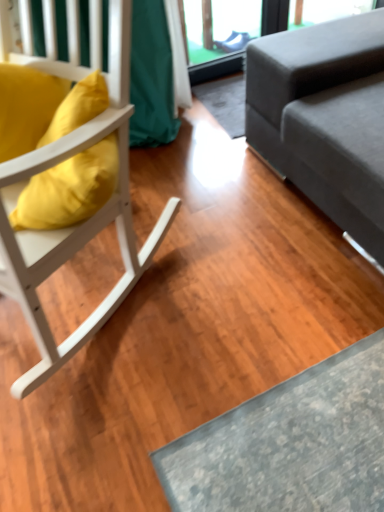
Question: From the image's perspective, is matte yellow pillow at left located above or below gray fabric couch at right?

Choices:
 (A) above
 (B) below

Answer: (B)

Question: Considering the positions of matte yellow pillow at left and gray fabric couch at right in the image, is matte yellow pillow at left bigger or smaller than gray fabric couch at right?

Choices:
 (A) small
 (B) big

Answer: (A)

Question: Which is farther from the matte yellow pillow at left?

Choices:
 (A) gray fabric couch at right
 (B) white wood chair at left

Answer: (A)

Question: Estimate the real-world distances between objects in this image. Which object is farther from the matte yellow pillow at left?

Choices:
 (A) gray fabric couch at right
 (B) white wood chair at left

Answer: (A)